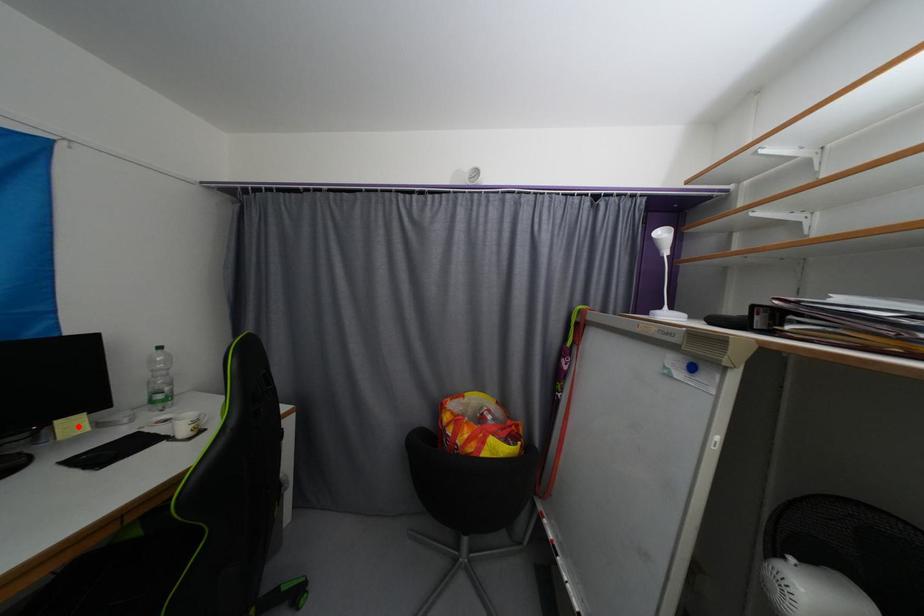
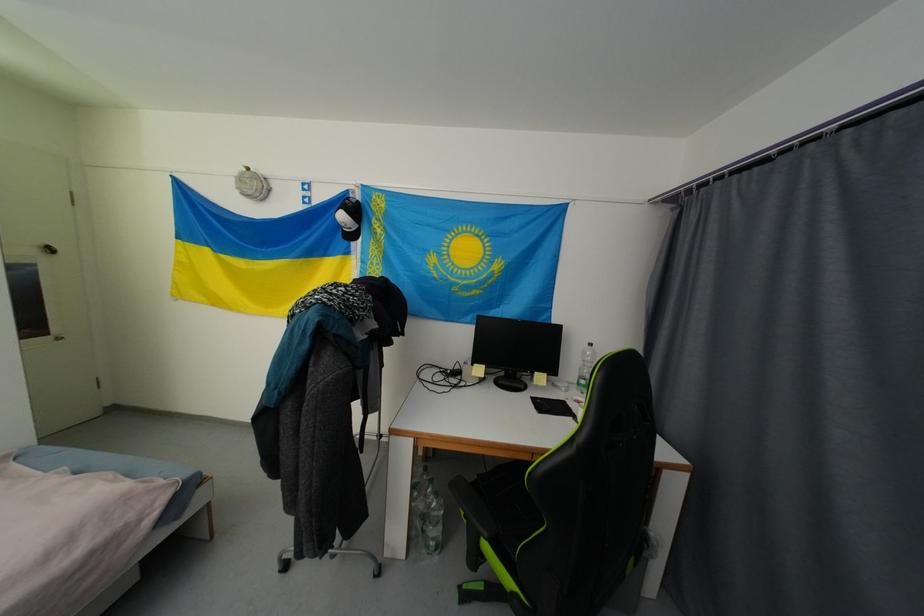
Locate, in the second image, the point that corresponds to the highlighted location in the first image.

(545, 379)